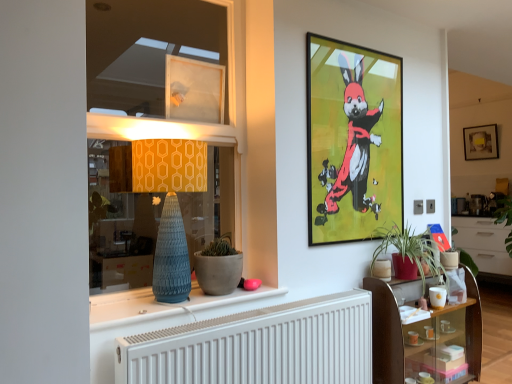
Question: Should I look upward or downward to see wooden glass shelf at lower right?

Choices:
 (A) down
 (B) up

Answer: (A)

Question: Considering the relative sizes of matte blue vase at center and white matte flowerpot at lower right, the 2th flowerpot viewed from the left, in the image provided, is matte blue vase at center shorter than white matte flowerpot at lower right, the 2th flowerpot viewed from the left,?

Choices:
 (A) no
 (B) yes

Answer: (B)

Question: Is matte blue vase at center in front of white matte flowerpot at lower right, arranged as the first flowerpot when viewed from the right?

Choices:
 (A) yes
 (B) no

Answer: (A)

Question: Is matte blue vase at center aimed at white matte flowerpot at lower right, the first flowerpot viewed from the back?

Choices:
 (A) no
 (B) yes

Answer: (A)

Question: Can you confirm if matte blue vase at center is bigger than white matte flowerpot at lower right, arranged as the first flowerpot when viewed from the right?

Choices:
 (A) yes
 (B) no

Answer: (A)

Question: Considering the relative positions of matte blue vase at center and white matte flowerpot at lower right, which appears as the second flowerpot when viewed from the front, in the image provided, is matte blue vase at center to the right of white matte flowerpot at lower right, which appears as the second flowerpot when viewed from the front, from the viewer's perspective?

Choices:
 (A) no
 (B) yes

Answer: (A)

Question: Does matte blue vase at center have a greater height compared to white matte flowerpot at lower right, the first flowerpot viewed from the back?

Choices:
 (A) no
 (B) yes

Answer: (A)

Question: Is metallic-framed artwork at upper center, the 2th picture frame from the front, at the left side of matte gold picture frame at upper right, which is counted as the first picture frame, starting from the right?

Choices:
 (A) yes
 (B) no

Answer: (A)

Question: Is metallic-framed artwork at upper center, the 2th picture frame from the front, wider than matte gold picture frame at upper right, the third picture frame when ordered from front to back?

Choices:
 (A) yes
 (B) no

Answer: (B)

Question: Can you confirm if metallic-framed artwork at upper center, the 2th picture frame from the front, is smaller than matte gold picture frame at upper right, the third picture frame positioned from the left?

Choices:
 (A) no
 (B) yes

Answer: (A)

Question: Is metallic-framed artwork at upper center, positioned as the 2th picture frame in right-to-left order, positioned far away from matte gold picture frame at upper right, the third picture frame positioned from the left?

Choices:
 (A) yes
 (B) no

Answer: (A)

Question: Is metallic-framed artwork at upper center, the 2th picture frame from the front, closer to the viewer compared to matte gold picture frame at upper right, the third picture frame when ordered from front to back?

Choices:
 (A) yes
 (B) no

Answer: (A)

Question: Can you confirm if metallic-framed artwork at upper center, the 2th picture frame from the front, is positioned to the right of matte gold picture frame at upper right, the 1th picture frame in the back-to-front sequence?

Choices:
 (A) no
 (B) yes

Answer: (A)

Question: Can you confirm if metallic-framed artwork at upper center, the 2th picture frame from the front, is wider than transparent plastic window at upper center, acting as the first picture frame starting from the front?

Choices:
 (A) no
 (B) yes

Answer: (A)